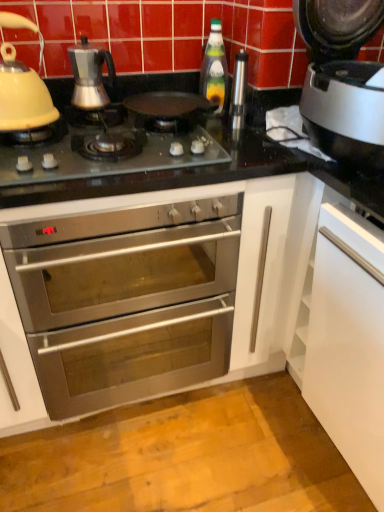
Question: Should I look upward or downward to see satin silver thermos at upper right, acting as the 2th appliance starting from the right?

Choices:
 (A) up
 (B) down

Answer: (A)

Question: Should I look upward or downward to see matte yellow kettle at left, placed as the second kitchen appliance when sorted from right to left?

Choices:
 (A) up
 (B) down

Answer: (A)

Question: Is satin silver coffee maker at upper left, which is counted as the first kitchen appliance, starting from the right, far away from green glass bottle at center?

Choices:
 (A) yes
 (B) no

Answer: (B)

Question: Can you confirm if satin silver coffee maker at upper left, which is counted as the first kitchen appliance, starting from the right, is wider than green glass bottle at center?

Choices:
 (A) yes
 (B) no

Answer: (A)

Question: Is satin silver coffee maker at upper left, which is the 2th kitchen appliance from left to right, positioned before green glass bottle at center?

Choices:
 (A) yes
 (B) no

Answer: (A)

Question: From the image's perspective, is satin silver coffee maker at upper left, which is the 2th kitchen appliance from left to right, above green glass bottle at center?

Choices:
 (A) yes
 (B) no

Answer: (B)

Question: Can you confirm if satin silver coffee maker at upper left, which is the 2th kitchen appliance from left to right, is thinner than green glass bottle at center?

Choices:
 (A) yes
 (B) no

Answer: (B)

Question: Is satin silver coffee maker at upper left, which is the 2th kitchen appliance from left to right, positioned beyond the bounds of green glass bottle at center?

Choices:
 (A) no
 (B) yes

Answer: (B)

Question: From the image's perspective, is matte yellow kettle at left, placed as the second kitchen appliance when sorted from right to left, over black glass gas stove at center?

Choices:
 (A) no
 (B) yes

Answer: (B)

Question: Is matte yellow kettle at left, the first kitchen appliance when ordered from left to right, positioned behind black glass gas stove at center?

Choices:
 (A) no
 (B) yes

Answer: (B)

Question: Considering the relative sizes of matte yellow kettle at left, placed as the second kitchen appliance when sorted from right to left, and black glass gas stove at center in the image provided, is matte yellow kettle at left, placed as the second kitchen appliance when sorted from right to left, taller than black glass gas stove at center?

Choices:
 (A) no
 (B) yes

Answer: (B)

Question: Is black glass gas stove at center completely or partially inside matte yellow kettle at left, placed as the second kitchen appliance when sorted from right to left?

Choices:
 (A) no
 (B) yes

Answer: (A)

Question: From a real-world perspective, is matte yellow kettle at left, the first kitchen appliance when ordered from left to right, physically below black glass gas stove at center?

Choices:
 (A) yes
 (B) no

Answer: (B)

Question: Considering the relative sizes of matte yellow kettle at left, the first kitchen appliance when ordered from left to right, and black glass gas stove at center in the image provided, is matte yellow kettle at left, the first kitchen appliance when ordered from left to right, thinner than black glass gas stove at center?

Choices:
 (A) no
 (B) yes

Answer: (B)

Question: Is white glossy dishwasher at lower right, the 1th appliance in the bottom-to-top sequence, outside green glass bottle at center?

Choices:
 (A) no
 (B) yes

Answer: (B)